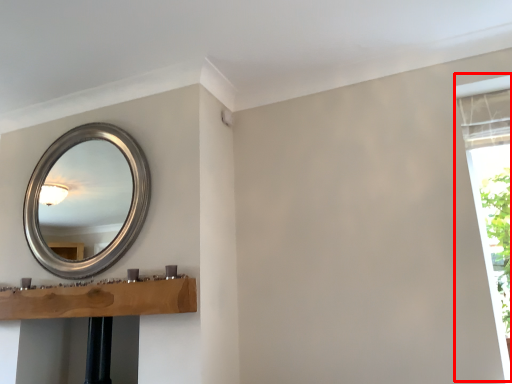
Question: From the image's perspective, where is window frame (annotated by the red box) located relative to mirror?

Choices:
 (A) below
 (B) above

Answer: (A)